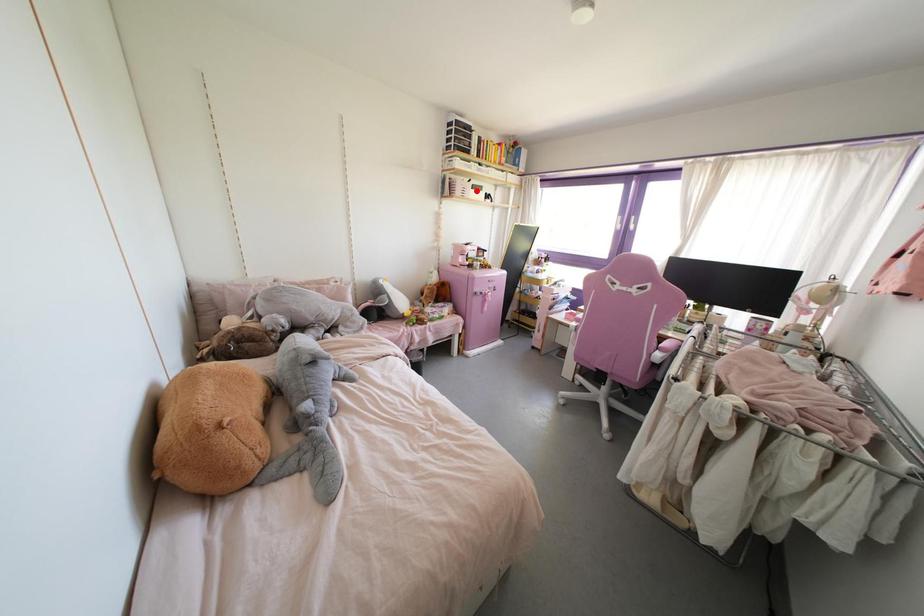
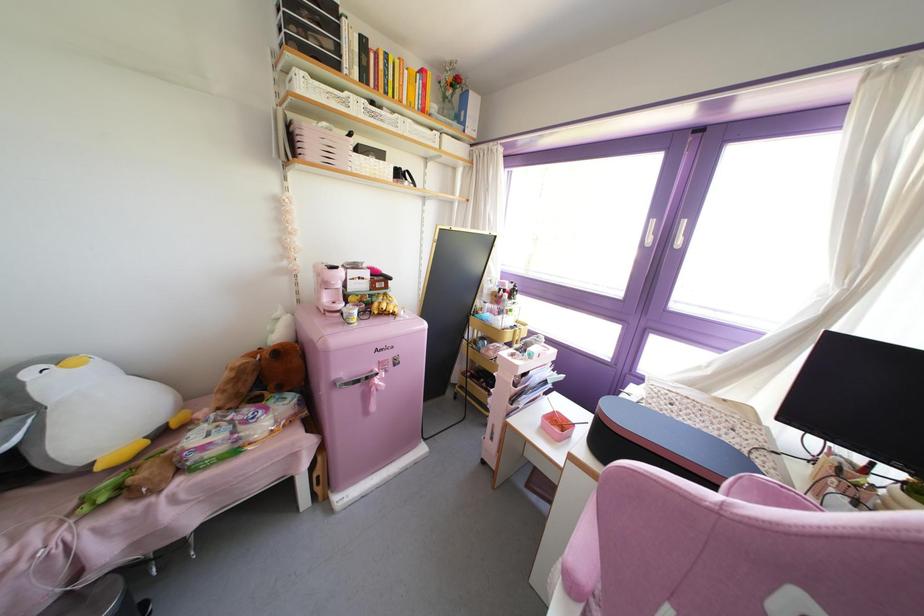
Locate, in the second image, the point that corresponds to the highlighted location in the first image.

(371, 160)